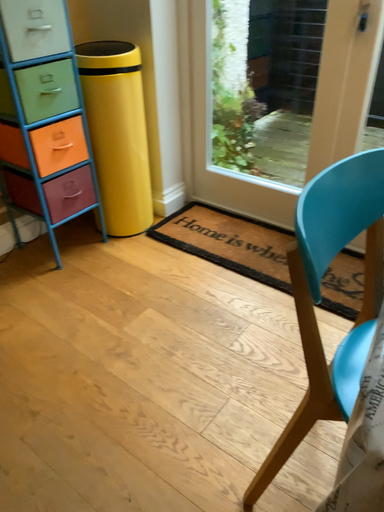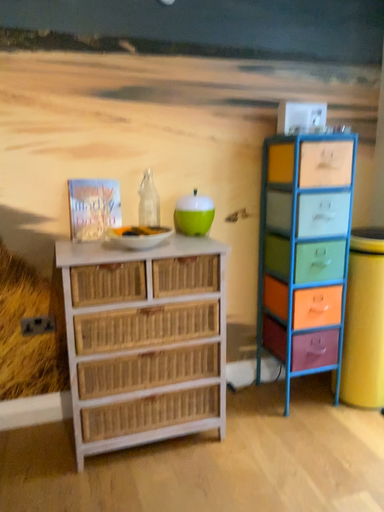
Question: How did the camera likely rotate when shooting the video?

Choices:
 (A) rotated left
 (B) rotated right

Answer: (A)